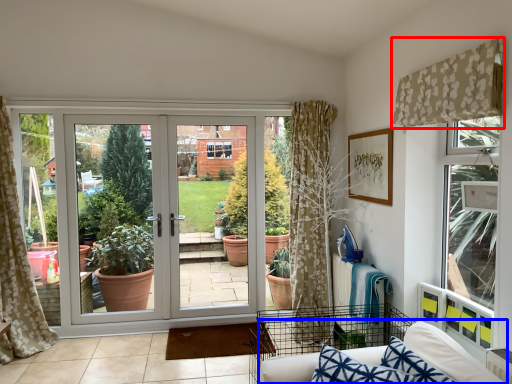
Question: Which point is closer to the camera, curtain (highlighted by a red box) or couch (highlighted by a blue box)?

Choices:
 (A) curtain
 (B) couch

Answer: (B)